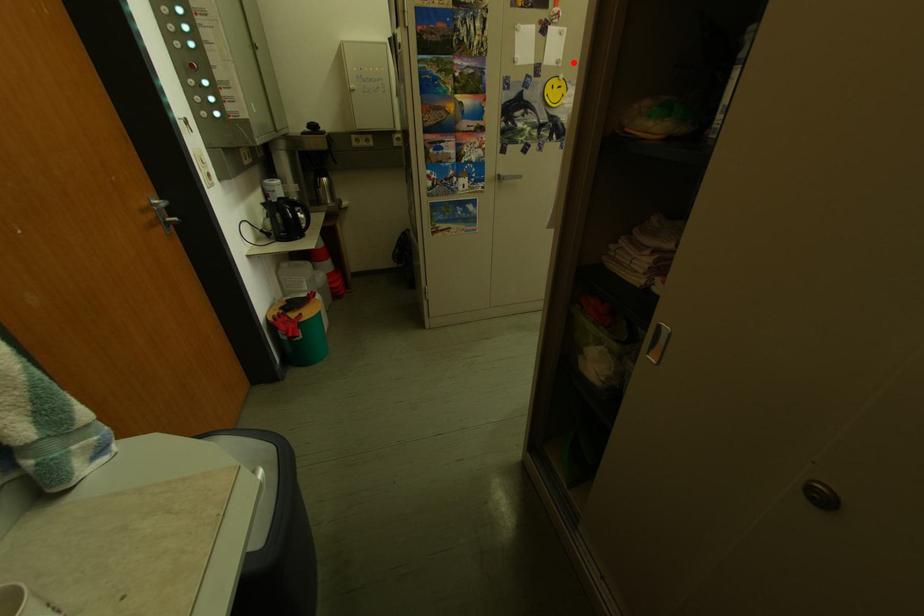
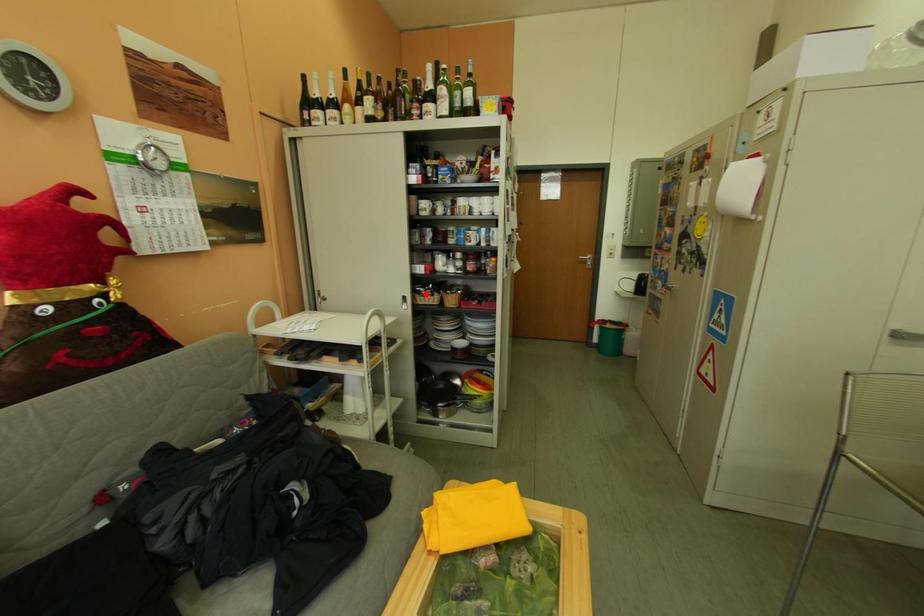
I am providing you with two images of the same scene from different viewpoints. A red point is marked on the first image and another point is marked on the second image. Is the marked point in image1 the same physical position as the marked point in image2?

No